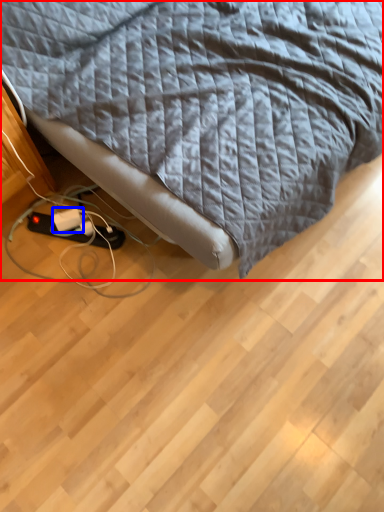
Question: Which object appears farthest to the camera in this image, bed (highlighted by a red box) or extension cord (highlighted by a blue box)?

Choices:
 (A) bed
 (B) extension cord

Answer: (B)